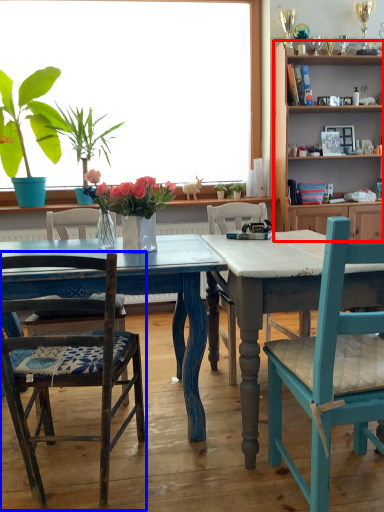
Question: Which point is closer to the camera, cabinetry (highlighted by a red box) or chair (highlighted by a blue box)?

Choices:
 (A) cabinetry
 (B) chair

Answer: (B)